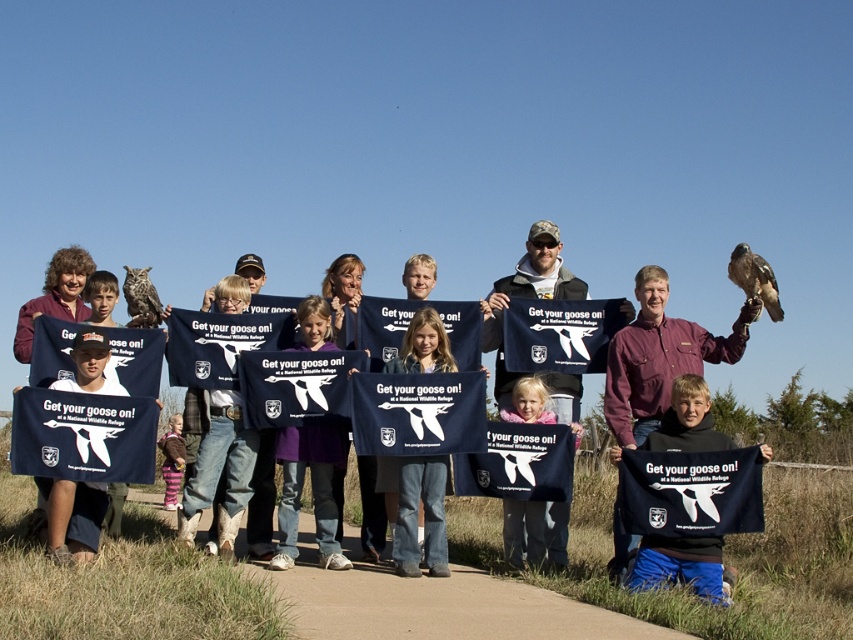
You are standing at the position of point (123,292) and want to walk towards point (781,317). Which direction should you move?

You should move forward because point (781,317) is further to the viewer than point (123,292), so it is in front of you.